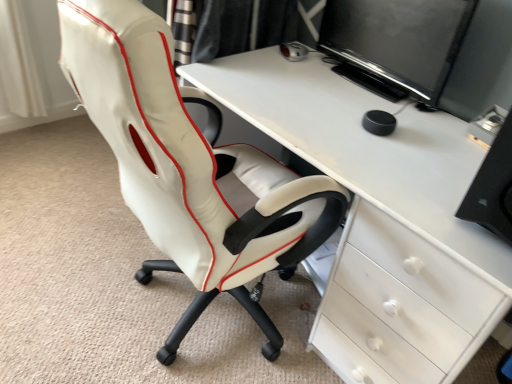
Question: Is black plastic computer tower at right to the right of white glossy desk at center from the viewer's perspective?

Choices:
 (A) yes
 (B) no

Answer: (A)

Question: Is black plastic computer tower at right positioned behind white glossy desk at center?

Choices:
 (A) yes
 (B) no

Answer: (B)

Question: Would you say black plastic computer tower at right contains white glossy desk at center?

Choices:
 (A) yes
 (B) no

Answer: (B)

Question: From a real-world perspective, does black plastic computer tower at right stand above white glossy desk at center?

Choices:
 (A) yes
 (B) no

Answer: (A)

Question: From the image's perspective, is black plastic computer tower at right on white glossy desk at center?

Choices:
 (A) yes
 (B) no

Answer: (A)

Question: Is black plastic computer tower at right at the left side of white glossy desk at center?

Choices:
 (A) yes
 (B) no

Answer: (B)

Question: From a real-world perspective, is white glossy desk at center below black plastic computer tower at right?

Choices:
 (A) yes
 (B) no

Answer: (A)

Question: From a real-world perspective, is white glossy desk at center on top of black plastic computer tower at right?

Choices:
 (A) yes
 (B) no

Answer: (B)

Question: Can you confirm if white glossy desk at center is positioned to the left of black plastic computer tower at right?

Choices:
 (A) yes
 (B) no

Answer: (A)

Question: Can you confirm if white glossy desk at center is bigger than black plastic computer tower at right?

Choices:
 (A) yes
 (B) no

Answer: (A)

Question: Is white glossy desk at center completely or partially outside of black plastic computer tower at right?

Choices:
 (A) no
 (B) yes

Answer: (B)

Question: Considering the relative sizes of white glossy desk at center and black plastic computer tower at right in the image provided, is white glossy desk at center wider than black plastic computer tower at right?

Choices:
 (A) no
 (B) yes

Answer: (B)

Question: Is black plastic computer tower at right positioned beyond the bounds of black glossy monitor at upper right?

Choices:
 (A) no
 (B) yes

Answer: (B)